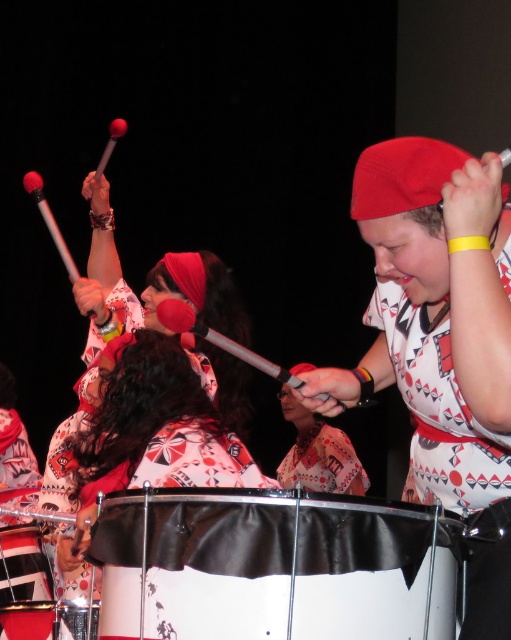
Question: Which point is closer to the camera?

Choices:
 (A) black leather drum at lower center
 (B) white matte drum at center
 (C) yellow rubber band at upper center

Answer: (C)

Question: Can you confirm if white matte drum at center is positioned below printed fabric drumstick at center?

Choices:
 (A) yes
 (B) no

Answer: (B)

Question: Among these points, which one is farthest from the camera?

Choices:
 (A) (308, 499)
 (B) (298, 481)
 (C) (103, 412)
 (D) (52, 611)

Answer: (B)

Question: Does white matte drum at center have a larger size compared to yellow rubber band at upper center?

Choices:
 (A) yes
 (B) no

Answer: (A)

Question: Which object appears closest to the camera in this image?

Choices:
 (A) black leather drum at lower center
 (B) white printed dress at center

Answer: (B)

Question: Considering the relative positions of white printed dress at center and black leather drum at lower center in the image provided, where is white printed dress at center located with respect to black leather drum at lower center?

Choices:
 (A) above
 (B) below

Answer: (A)